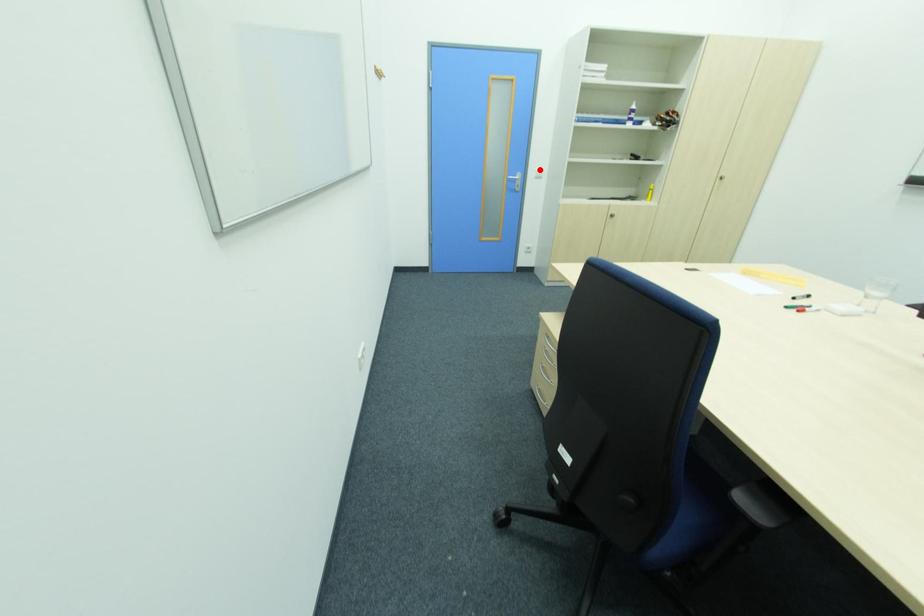
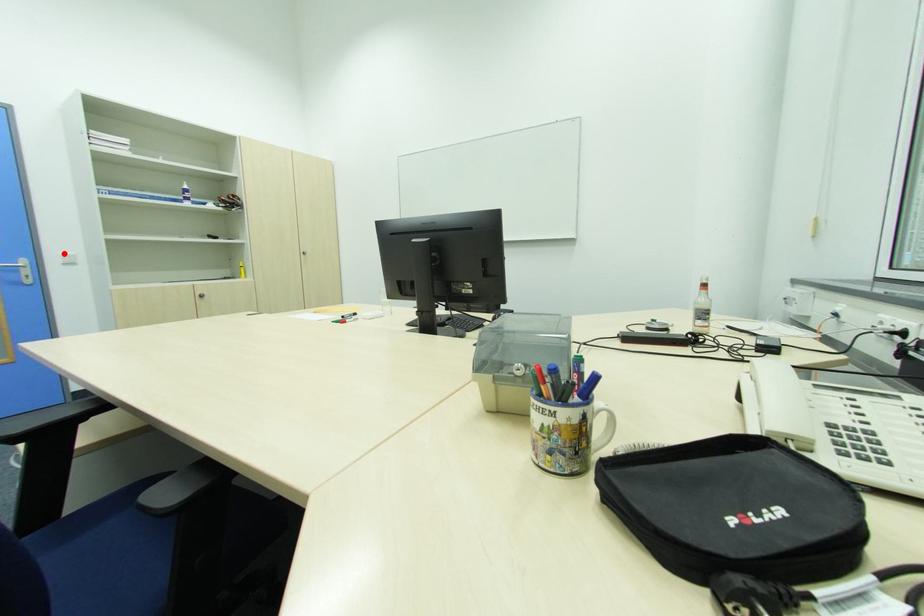
I am providing you with two images of the same scene from different viewpoints. A red point is marked on the first image and another point is marked on the second image. Is the red point in image1 aligned with the point shown in image2?

Yes